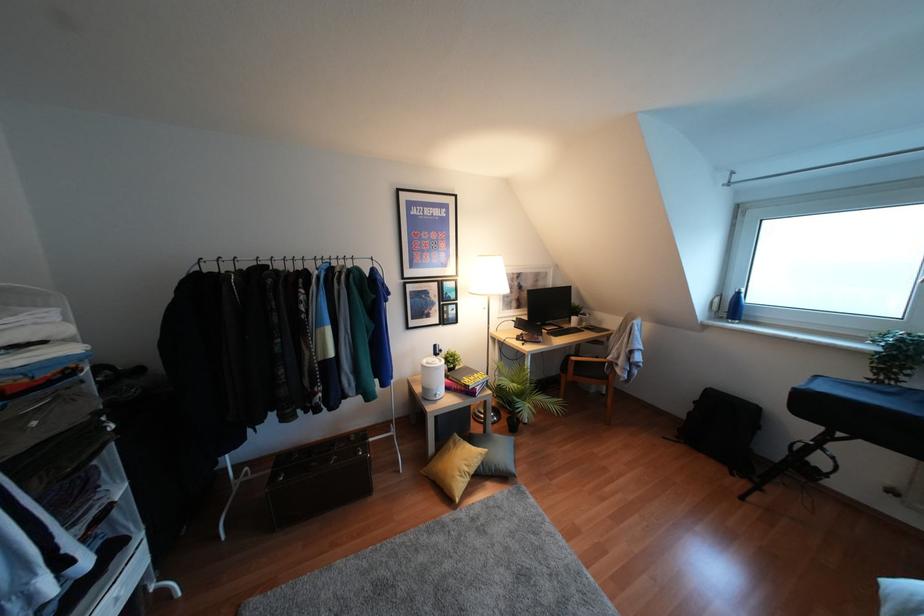
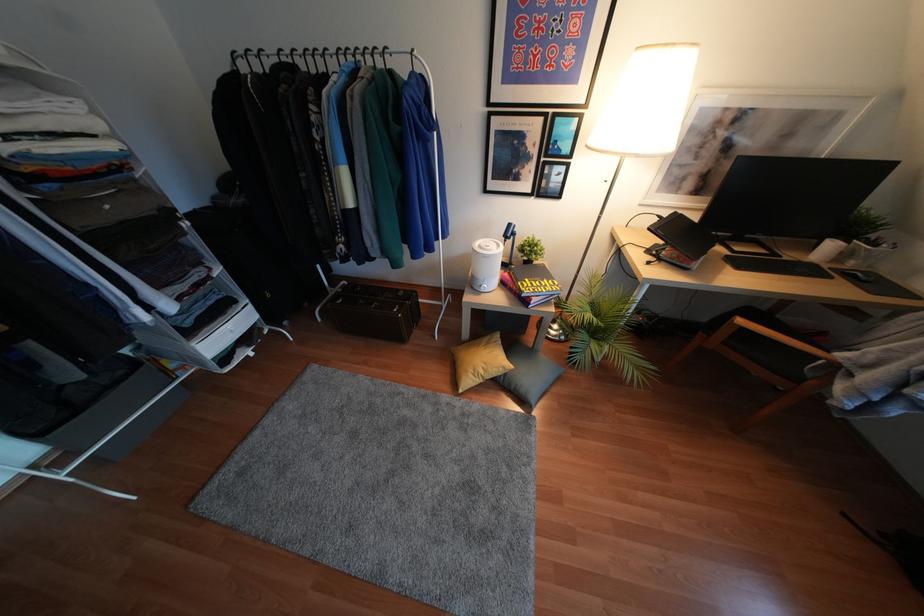
In the second image, find the point that corresponds to pixel 573 358 in the first image.

(739, 321)